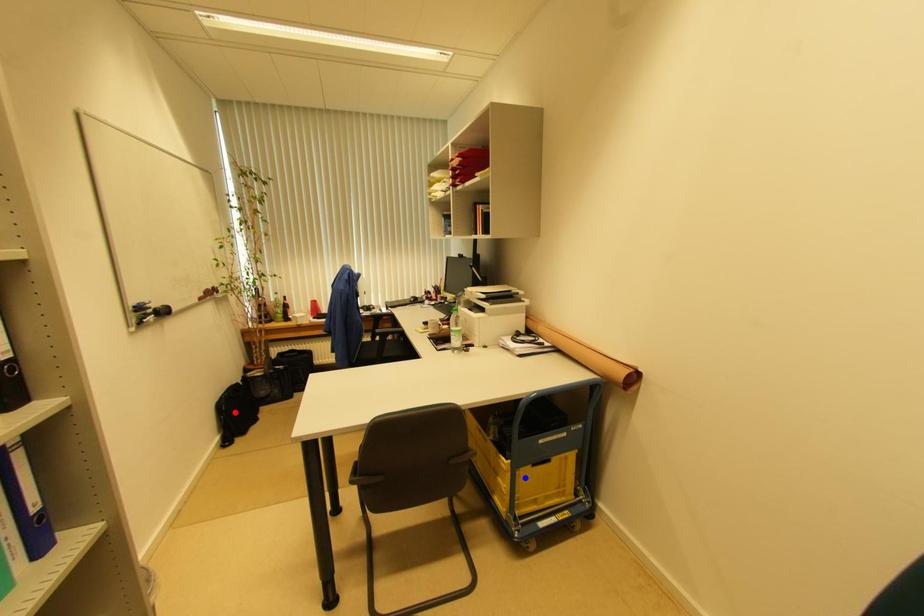
Question: In the image, two points are highlighted. Which point is nearer to the camera? Reply with the corresponding letter.

Choices:
 (A) blue point
 (B) red point

Answer: (A)